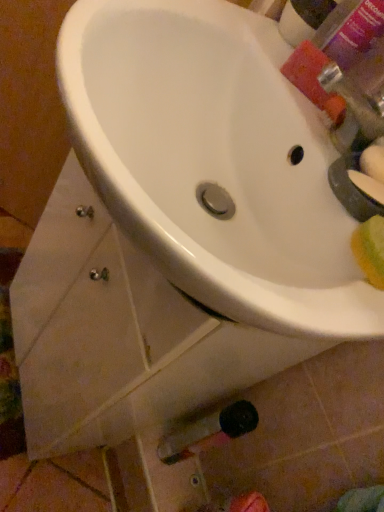
Question: From a real-world perspective, is white glossy sink at center positioned under pink matte bottle at upper right based on gravity?

Choices:
 (A) no
 (B) yes

Answer: (B)

Question: Is white glossy sink at center oriented towards pink matte bottle at upper right?

Choices:
 (A) no
 (B) yes

Answer: (A)

Question: Can you confirm if white glossy sink at center is wider than pink matte bottle at upper right?

Choices:
 (A) no
 (B) yes

Answer: (B)

Question: Is white glossy sink at center outside pink matte bottle at upper right?

Choices:
 (A) no
 (B) yes

Answer: (B)

Question: Considering the relative positions of white glossy sink at center and pink matte bottle at upper right in the image provided, is white glossy sink at center in front of pink matte bottle at upper right?

Choices:
 (A) yes
 (B) no

Answer: (A)

Question: Does white glossy sink at center contain pink matte bottle at upper right?

Choices:
 (A) no
 (B) yes

Answer: (A)

Question: Are white glossy sink at center and green matte soap at right far apart?

Choices:
 (A) no
 (B) yes

Answer: (A)

Question: Is white glossy sink at center oriented towards green matte soap at right?

Choices:
 (A) yes
 (B) no

Answer: (B)

Question: Considering the relative sizes of white glossy sink at center and green matte soap at right in the image provided, is white glossy sink at center taller than green matte soap at right?

Choices:
 (A) yes
 (B) no

Answer: (A)

Question: Is white glossy sink at center positioned behind green matte soap at right?

Choices:
 (A) no
 (B) yes

Answer: (A)

Question: Is white glossy sink at center shorter than green matte soap at right?

Choices:
 (A) yes
 (B) no

Answer: (B)

Question: Considering the relative sizes of white glossy sink at center and green matte soap at right in the image provided, is white glossy sink at center smaller than green matte soap at right?

Choices:
 (A) no
 (B) yes

Answer: (A)

Question: Is pink matte bottle at upper right oriented away from white glossy sink at center?

Choices:
 (A) no
 (B) yes

Answer: (A)